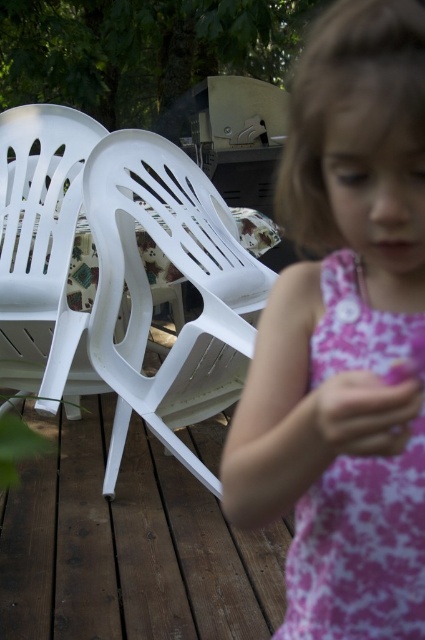
Based on the photo, can you confirm if white plastic chair at center is positioned above pink floral dress at center?

Yes.

Is the position of white plastic chair at center more distant than that of pink floral dress at center?

Yes, white plastic chair at center is behind pink floral dress at center.

Who is more distant from viewer, [269,275] or [379,577]?

Positioned behind is point [269,275].

At what (x,y) coordinates should I click in order to perform the action: click on white plastic chair at center. Please return your answer as a coordinate pair (x, y). Image resolution: width=425 pixels, height=640 pixels. Looking at the image, I should click on (183, 275).

Between pink floral dress at center and white plastic chair at left, which one appears on the left side from the viewer's perspective?

From the viewer's perspective, white plastic chair at left appears more on the left side.

Can you confirm if pink floral dress at center is thinner than white plastic chair at left?

Indeed, pink floral dress at center has a lesser width compared to white plastic chair at left.

Is point (295, 618) positioned before point (73, 364)?

That is True.

Locate an element on the screen. The height and width of the screenshot is (640, 425). pink floral dress at center is located at coordinates (359, 548).

What do you see at coordinates (183, 275) in the screenshot? This screenshot has height=640, width=425. I see `white plastic chair at center` at bounding box center [183, 275].

Is white plastic chair at center to the left of white plastic chair at left from the viewer's perspective?

In fact, white plastic chair at center is to the right of white plastic chair at left.

Locate an element on the screen. Image resolution: width=425 pixels, height=640 pixels. white plastic chair at center is located at coordinates pos(183,275).